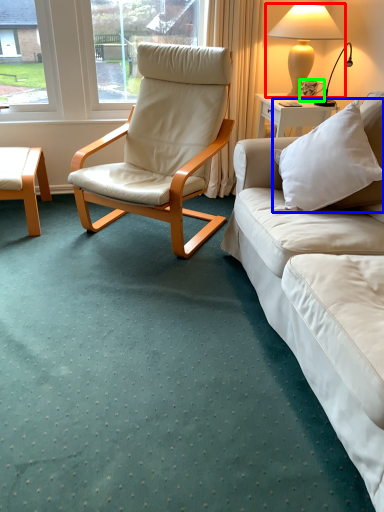
Question: Based on their relative distances, which object is farther from lamp (highlighted by a red box)? Choose from pillow (highlighted by a blue box) and coffee cup (highlighted by a green box).

Choices:
 (A) pillow
 (B) coffee cup

Answer: (A)